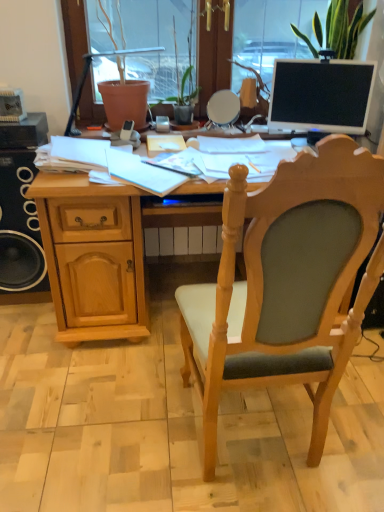
Identify the location of light wood desk at center. (102, 262).

Measure the distance between point [125,138] and camera.

Point [125,138] is 1.93 meters from camera.

Image resolution: width=384 pixels, height=512 pixels. Describe the element at coordinates (344, 28) in the screenshot. I see `green textured plant at upper right` at that location.

This screenshot has height=512, width=384. In order to click on light wood/wooden chair at center in this screenshot , I will do 286,283.

Find the location of a particular element. This screenshot has width=384, height=512. light wood desk at center is located at coordinates (102, 262).

From the image's perspective, is matte black monitor at upper right below matte black phone at center, positioned as the 2th mobile phone in back-to-front order?

Actually, matte black monitor at upper right appears above matte black phone at center, positioned as the 2th mobile phone in back-to-front order, in the image.

Is matte black monitor at upper right not inside matte black phone at center, which ranks as the first mobile phone in left-to-right order?

Yes, matte black monitor at upper right is located beyond the bounds of matte black phone at center, which ranks as the first mobile phone in left-to-right order.

Is matte black monitor at upper right in front of or behind matte black phone at center, arranged as the 1th mobile phone when ordered from the bottom, in the image?

Visually, matte black monitor at upper right is located in front of matte black phone at center, arranged as the 1th mobile phone when ordered from the bottom.

Looking at this image, from a real-world perspective, which object stands above the other?

In real-world perspective, matte black monitor at upper right is above.

Is light wood/wooden chair at center smaller than matte black phone at center, which ranks as the first mobile phone in left-to-right order?

No, light wood/wooden chair at center is not smaller than matte black phone at center, which ranks as the first mobile phone in left-to-right order.

Is the position of light wood/wooden chair at center less distant than that of matte black phone at center, positioned as the 2th mobile phone in back-to-front order?

Yes, the depth of light wood/wooden chair at center is less than that of matte black phone at center, positioned as the 2th mobile phone in back-to-front order.

Considering the relative positions of light wood/wooden chair at center and matte black phone at center, arranged as the 2th mobile phone when viewed from the right, in the image provided, is light wood/wooden chair at center to the left or to the right of matte black phone at center, arranged as the 2th mobile phone when viewed from the right,?

In the image, light wood/wooden chair at center appears on the right side of matte black phone at center, arranged as the 2th mobile phone when viewed from the right.

Is light wood/wooden chair at center taller than matte black phone at center, which ranks as the first mobile phone in left-to-right order?

Yes.

Consider the image. Who is more distant, green textured plant at upper right or satin silver phone at center, the second mobile phone positioned from the front?

satin silver phone at center, the second mobile phone positioned from the front, is further away from the camera.

Is green textured plant at upper right oriented away from satin silver phone at center, acting as the 2th mobile phone starting from the left?

No, satin silver phone at center, acting as the 2th mobile phone starting from the left, is not at the back of green textured plant at upper right.

Is green textured plant at upper right far away from satin silver phone at center, which is the first mobile phone in top-to-bottom order?

No, green textured plant at upper right is not far from satin silver phone at center, which is the first mobile phone in top-to-bottom order.

Identify the location of mobile phone that is the 2nd one when counting backward from the green textured plant at upper right. (162, 124).

Which point is more forward, (337, 260) or (135, 286)?

The point (337, 260) is in front.

At what (x,y) coordinates should I click in order to perform the action: click on chair to the right of light wood desk at center. Please return your answer as a coordinate pair (x, y). The width and height of the screenshot is (384, 512). Looking at the image, I should click on (286, 283).

In terms of size, does light wood/wooden chair at center appear bigger or smaller than light wood desk at center?

Clearly, light wood/wooden chair at center is smaller in size than light wood desk at center.

Between light wood desk at center and light wood/wooden chair at center, which one appears on the right side from the viewer's perspective?

light wood/wooden chair at center.

Can you confirm if light wood desk at center is taller than light wood/wooden chair at center?

Incorrect, the height of light wood desk at center is not larger of that of light wood/wooden chair at center.

Looking at this image, is light wood desk at center not inside light wood/wooden chair at center?

light wood desk at center lies outside light wood/wooden chair at center's area.

From the image's perspective, which object appears higher, light wood/wooden chair at center or matte black monitor at upper right?

matte black monitor at upper right appears higher in the image.

What's the angular difference between light wood/wooden chair at center and matte black monitor at upper right's facing directions?

153 degrees.

You are a GUI agent. You are given a task and a screenshot of the screen. Output one action in this format:
    pyautogui.click(x=<x>, y=<y>)
    Task: Click on the chair lying in front of the matte black monitor at upper right
    The width and height of the screenshot is (384, 512).
    Given the screenshot: What is the action you would take?
    pyautogui.click(x=286, y=283)

Does light wood/wooden chair at center have a lesser width compared to matte black monitor at upper right?

No.

From the image's perspective, which object appears higher, green textured plant at upper right or matte black monitor at upper right?

From the image's view, green textured plant at upper right is above.

Do you think green textured plant at upper right is within matte black monitor at upper right, or outside of it?

green textured plant at upper right is outside matte black monitor at upper right.

From a real-world perspective, who is located higher, green textured plant at upper right or matte black monitor at upper right?

In real-world perspective, green textured plant at upper right is above.

Considering the positions of objects green textured plant at upper right and matte black monitor at upper right in the image provided, who is behind, green textured plant at upper right or matte black monitor at upper right?

green textured plant at upper right.

The width and height of the screenshot is (384, 512). Find the location of `computer monitor in front of the matte black phone at center, arranged as the 1th mobile phone when ordered from the bottom`. computer monitor in front of the matte black phone at center, arranged as the 1th mobile phone when ordered from the bottom is located at coordinates (321, 96).

Identify the location of chair that is below the matte black phone at center, positioned as the 2th mobile phone in back-to-front order (from the image's perspective). The image size is (384, 512). (286, 283).

From the image, which object appears to be nearer to black matte speaker at left, light wood desk at center or green textured plant at upper right?

Result: light wood desk at center is closer to black matte speaker at left.

When comparing their distances from green textured plant at upper right, does satin silver phone at center, the second mobile phone positioned from the front, or light wood desk at center seem closer?

satin silver phone at center, the second mobile phone positioned from the front, is positioned closer to the anchor green textured plant at upper right.

Which object lies further to the anchor point matte black phone at center, the 1th mobile phone from the front, satin silver phone at center, which is the first mobile phone in top-to-bottom order, or black matte speaker at left?

black matte speaker at left lies further to matte black phone at center, the 1th mobile phone from the front, than the other object.

From the image, which object appears to be nearer to green textured plant at upper right, black matte speaker at left or matte black phone at center, positioned as the 2th mobile phone in back-to-front order?

The object closer to green textured plant at upper right is matte black phone at center, positioned as the 2th mobile phone in back-to-front order.

Estimate the real-world distances between objects in this image. Which object is closer to matte black phone at center, arranged as the 2th mobile phone when viewed from the right, green textured plant at upper right or satin silver phone at center, the second mobile phone positioned from the front?

satin silver phone at center, the second mobile phone positioned from the front, is closer to matte black phone at center, arranged as the 2th mobile phone when viewed from the right.

Based on their spatial positions, is satin silver phone at center, arranged as the first mobile phone when viewed from the back, or light wood desk at center closer to black matte speaker at left?

Among the two, light wood desk at center is located nearer to black matte speaker at left.

When comparing their distances from satin silver phone at center, which ranks as the 2th mobile phone in bottom-to-top order, does light wood desk at center or black matte speaker at left seem further?

Based on the image, black matte speaker at left appears to be further to satin silver phone at center, which ranks as the 2th mobile phone in bottom-to-top order.

Looking at the image, which one is located further to matte black phone at center, positioned as the 2th mobile phone in back-to-front order, matte black monitor at upper right or satin silver phone at center, acting as the 2th mobile phone starting from the left?

The object further to matte black phone at center, positioned as the 2th mobile phone in back-to-front order, is matte black monitor at upper right.

The image size is (384, 512). I want to click on computer monitor between black matte speaker at left and green textured plant at upper right in the horizontal direction, so click(x=321, y=96).

This screenshot has height=512, width=384. I want to click on mobile phone located between matte black phone at center, arranged as the 1th mobile phone when ordered from the bottom, and matte black monitor at upper right in the left-right direction, so click(162, 124).

This screenshot has height=512, width=384. In order to click on desk between light wood/wooden chair at center and matte black monitor at upper right in the front-back direction in this screenshot , I will do `click(102, 262)`.

Locate an element on the screen. The image size is (384, 512). desk positioned between light wood/wooden chair at center and matte black phone at center, which is the 2th mobile phone from top to bottom, from near to far is located at coordinates (102, 262).